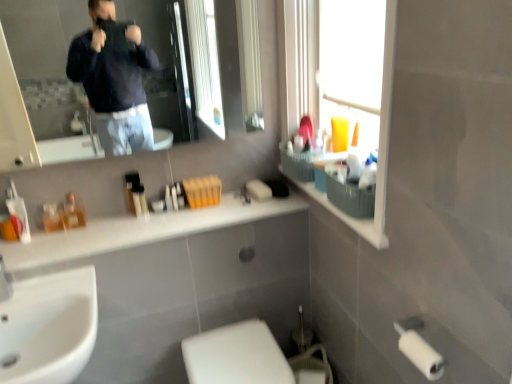
This screenshot has height=384, width=512. I want to click on space that is in front of translucent glass perfume at center, the second toiletry positioned from the left, so [x=65, y=239].